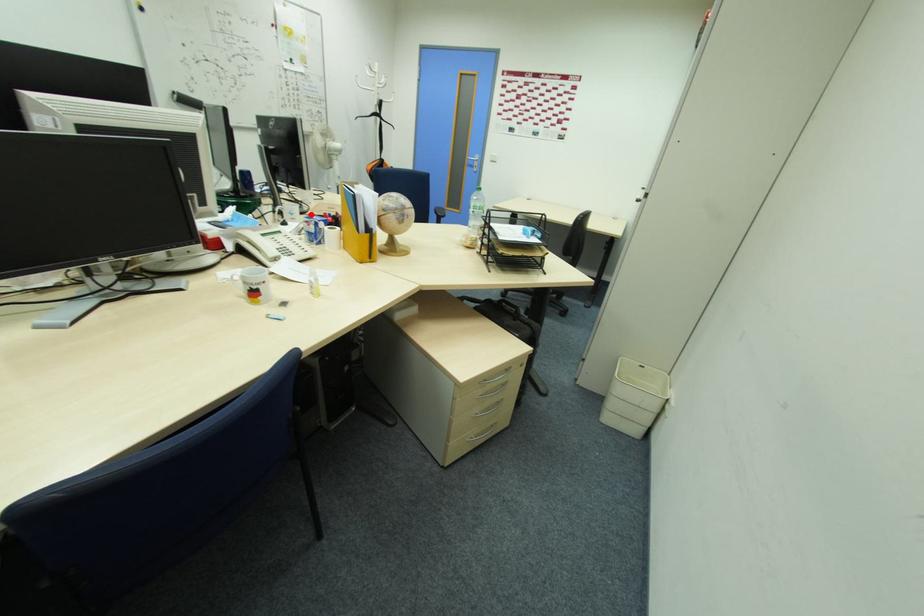
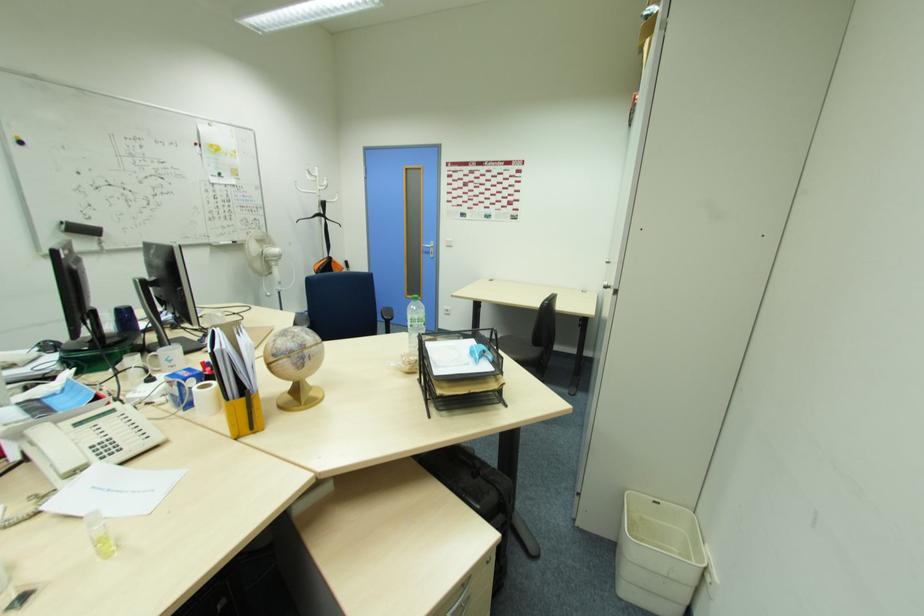
Question: I am providing you with two images of the same scene from different viewpoints. Image1 has a red point marked. In image2, the corresponding 3D location appears at what relative position? Reply with the corresponding letter.

Choices:
 (A) Closer
 (B) Farther

Answer: (B)